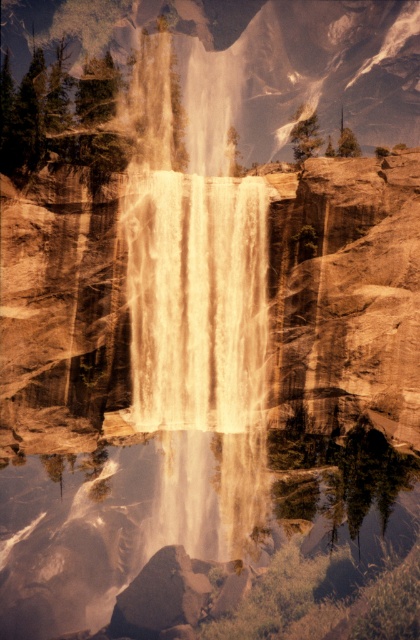
I want to click on translucent water at center, so click(196, 560).

Can you confirm if translucent water at center is positioned to the left of white frothy water at center?

Correct, you'll find translucent water at center to the left of white frothy water at center.

Where is `translucent water at center`? The height and width of the screenshot is (640, 420). translucent water at center is located at coordinates (196, 560).